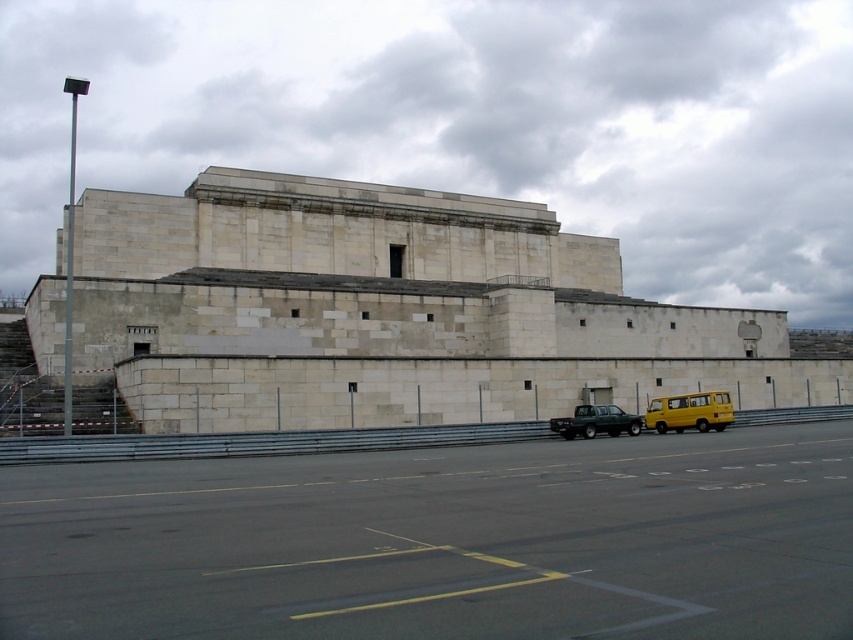
Question: Which point is closer to the camera taking this photo?

Choices:
 (A) (724, 419)
 (B) (589, 433)

Answer: (B)

Question: Is yellow matte van at lower right to the left of matte black truck at center from the viewer's perspective?

Choices:
 (A) yes
 (B) no

Answer: (B)

Question: Can you confirm if yellow matte van at lower right is smaller than matte black truck at center?

Choices:
 (A) no
 (B) yes

Answer: (B)

Question: Is yellow matte van at lower right thinner than matte black truck at center?

Choices:
 (A) yes
 (B) no

Answer: (B)